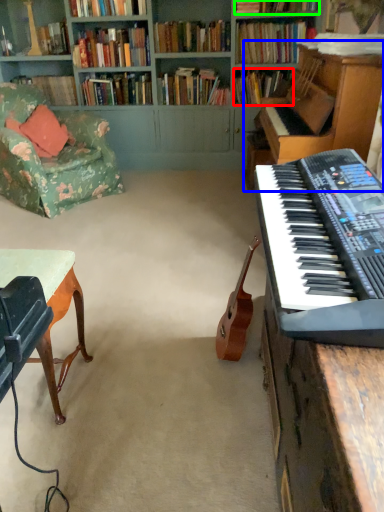
Question: Estimate the real-world distances between objects in this image. Which object is closer to book (highlighted by a red box), piano (highlighted by a blue box) or book (highlighted by a green box)?

Choices:
 (A) piano
 (B) book

Answer: (B)